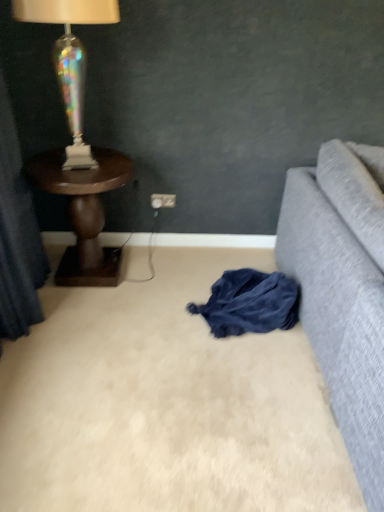
Question: Is dark wood side table at left thinner than white plastic power outlet at center?

Choices:
 (A) no
 (B) yes

Answer: (A)

Question: From the image's perspective, would you say dark wood side table at left is shown under white plastic power outlet at center?

Choices:
 (A) yes
 (B) no

Answer: (A)

Question: Is dark wood side table at left aimed at white plastic power outlet at center?

Choices:
 (A) no
 (B) yes

Answer: (A)

Question: Is dark wood side table at left wider than white plastic power outlet at center?

Choices:
 (A) no
 (B) yes

Answer: (B)

Question: From the image's perspective, would you say dark wood side table at left is positioned over white plastic power outlet at center?

Choices:
 (A) yes
 (B) no

Answer: (B)

Question: Considering the positions of point (150, 195) and point (86, 201), is point (150, 195) closer or farther from the camera than point (86, 201)?

Choices:
 (A) farther
 (B) closer

Answer: (A)

Question: Based on their positions, is white plastic power outlet at center located to the left or right of dark wood side table at left?

Choices:
 (A) left
 (B) right

Answer: (B)

Question: Considering the positions of white plastic power outlet at center and dark wood side table at left in the image, is white plastic power outlet at center bigger or smaller than dark wood side table at left?

Choices:
 (A) big
 (B) small

Answer: (B)

Question: In terms of height, does white plastic power outlet at center look taller or shorter compared to dark wood side table at left?

Choices:
 (A) short
 (B) tall

Answer: (A)

Question: From a real-world perspective, is iridescent glass lamp at upper left positioned above or below white plastic power outlet at center?

Choices:
 (A) below
 (B) above

Answer: (B)

Question: Considering the relative positions of iridescent glass lamp at upper left and white plastic power outlet at center in the image provided, is iridescent glass lamp at upper left to the left or to the right of white plastic power outlet at center?

Choices:
 (A) right
 (B) left

Answer: (B)

Question: Is iridescent glass lamp at upper left taller or shorter than white plastic power outlet at center?

Choices:
 (A) tall
 (B) short

Answer: (A)

Question: Would you say iridescent glass lamp at upper left is inside or outside white plastic power outlet at center?

Choices:
 (A) outside
 (B) inside

Answer: (A)

Question: Do you think dark blue fabric at lower center is within dark blue fabric at left, or outside of it?

Choices:
 (A) outside
 (B) inside

Answer: (A)

Question: From a real-world perspective, relative to dark blue fabric at left, is dark blue fabric at lower center vertically above or below?

Choices:
 (A) below
 (B) above

Answer: (A)